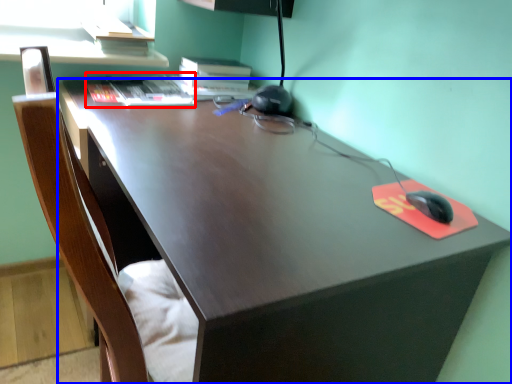
Question: Which object is closer to the camera taking this photo, book (highlighted by a red box) or desk (highlighted by a blue box)?

Choices:
 (A) book
 (B) desk

Answer: (B)